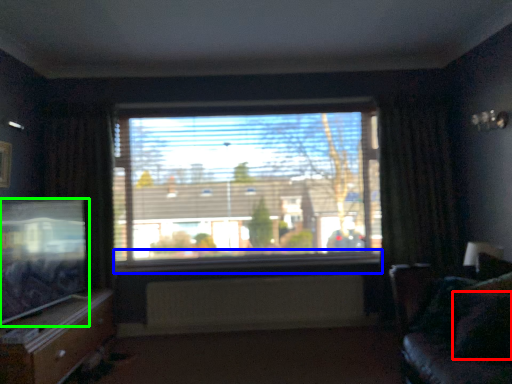
Question: Considering the real-world distances, which object is closest to pillow (highlighted by a red box)? window sill (highlighted by a blue box) or television (highlighted by a green box).

Choices:
 (A) window sill
 (B) television

Answer: (A)